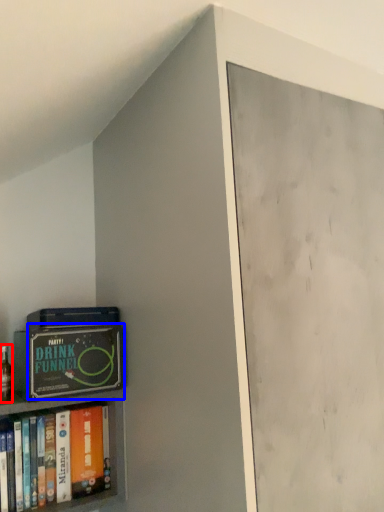
Question: Among these objects, which one is nearest to the camera, alcohol (highlighted by a red box) or paperback book (highlighted by a blue box)?

Choices:
 (A) alcohol
 (B) paperback book

Answer: (B)